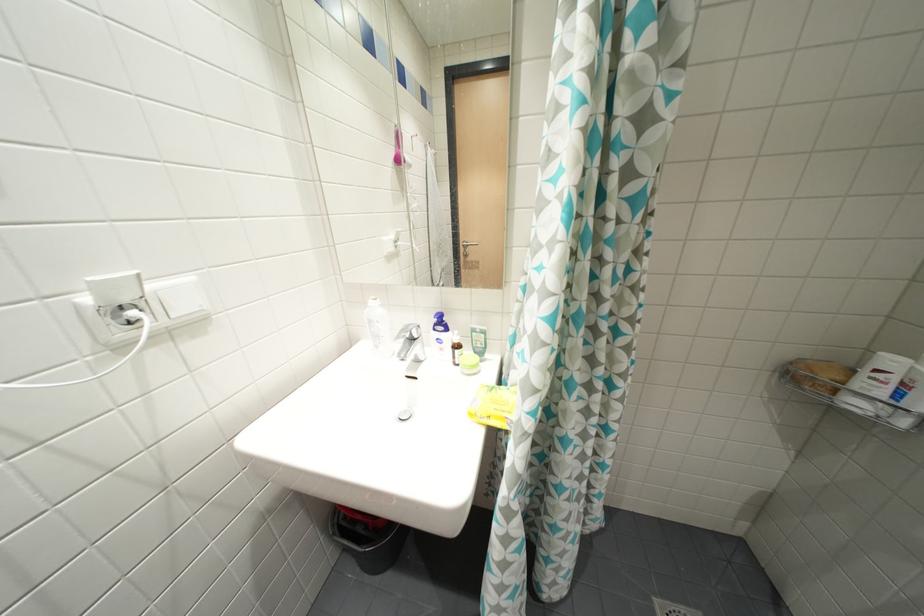
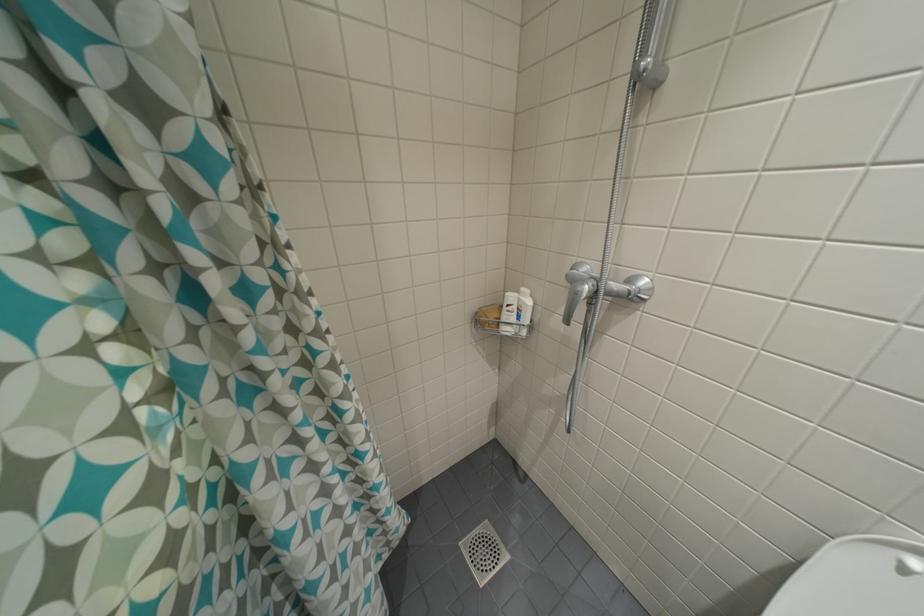
Question: How did the camera likely rotate?

Choices:
 (A) Left
 (B) Right
 (C) Up
 (D) Down

Answer: (B)